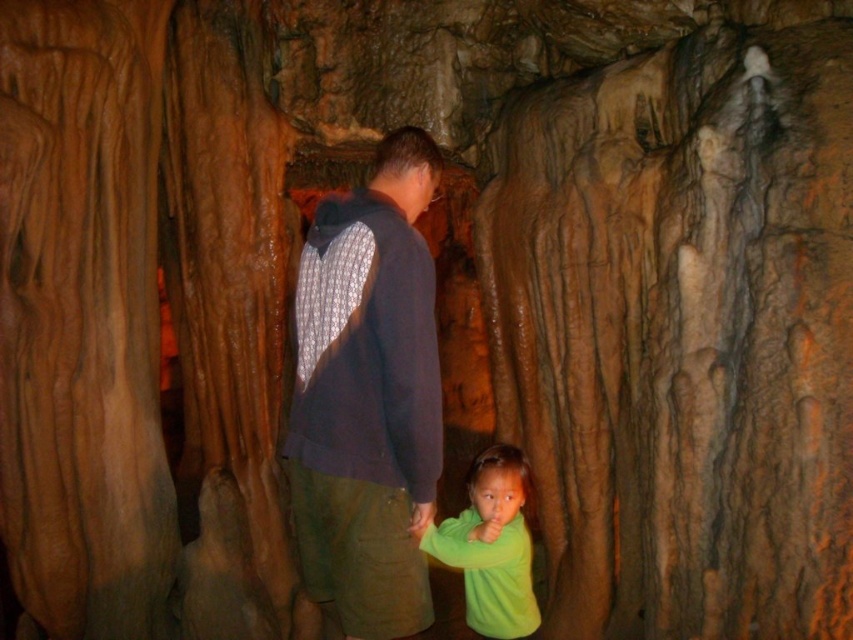
Who is taller, dark blue hoodie at center or green matte shirt at lower center?

dark blue hoodie at center is taller.

Which is behind, point (355, 218) or point (503, 518)?

The point (503, 518) is behind.

Is point (416, 312) closer to camera compared to point (502, 516)?

Yes.

At what (x,y) coordinates should I click in order to perform the action: click on dark blue hoodie at center. Please return your answer as a coordinate pair (x, y). The height and width of the screenshot is (640, 853). Looking at the image, I should click on (368, 396).